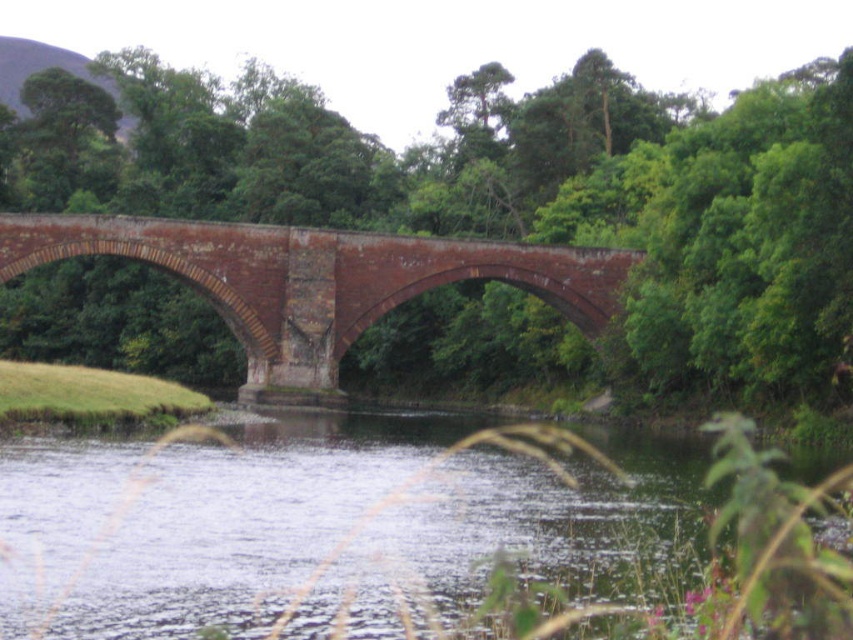
Can you confirm if green water at lower center is thinner than brick bridge at center?

Yes.

Is green water at lower center to the left of brick bridge at center from the viewer's perspective?

In fact, green water at lower center is to the right of brick bridge at center.

Where is `green water at lower center`? green water at lower center is located at coordinates (367, 528).